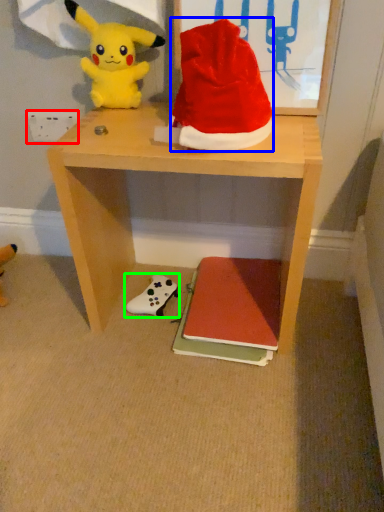
Question: Considering the real-world distances, which object is farthest from power outlet (highlighted by a red box)? hat (highlighted by a blue box) or toy (highlighted by a green box)?

Choices:
 (A) hat
 (B) toy

Answer: (B)